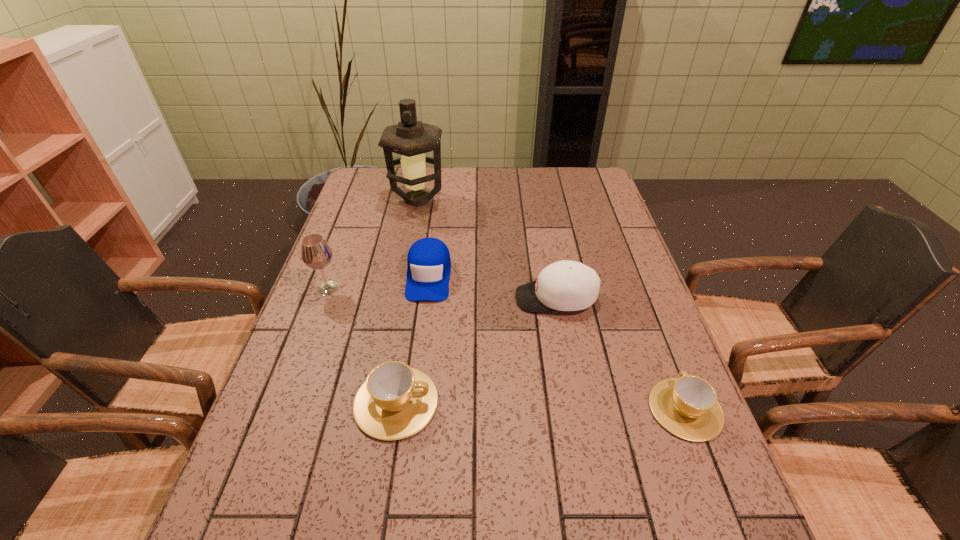
I want to click on vacant space at the far left corner, so click(377, 193).

You are a GUI agent. You are given a task and a screenshot of the screen. Output one action in this format:
    pyautogui.click(x=<x>, y=<y>)
    Task: Click on the vacant space at the near left corner of the desktop
    The image size is (960, 540).
    Given the screenshot: What is the action you would take?
    pyautogui.click(x=317, y=494)

I want to click on vacant region at the far right corner of the desktop, so click(x=577, y=190).

Identify the location of unoccupied area between the right baseball cap and the rightmost object. (620, 354).

I want to click on vacant area that lies between the leftmost object and the left baseball cap, so click(x=378, y=282).

Image resolution: width=960 pixels, height=540 pixels. What are the coordinates of `vacant point located between the wineglass and the tallest object` in the screenshot? It's located at (372, 245).

The height and width of the screenshot is (540, 960). What are the coordinates of `blank region between the farthest object and the fifth object from left to right` in the screenshot? It's located at (487, 249).

The image size is (960, 540). Identify the location of free area in between the right cup and the taller baseball cap. (620, 354).

Image resolution: width=960 pixels, height=540 pixels. I want to click on free space between the taller cup and the right baseball cap, so click(476, 350).

Image resolution: width=960 pixels, height=540 pixels. I want to click on vacant area that lies between the taller baseball cap and the left baseball cap, so click(492, 287).